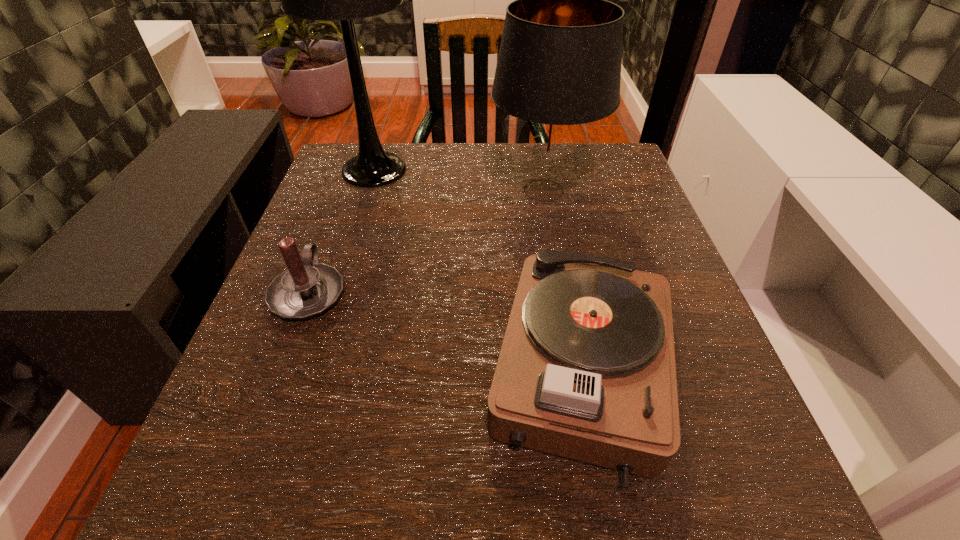
Where is `free spot between the candle and the lampshade`? free spot between the candle and the lampshade is located at coordinates (426, 241).

This screenshot has width=960, height=540. Identify the location of vacant space that's between the lampshade and the tallest object. (459, 180).

At what (x,y) coordinates should I click in order to perform the action: click on vacant area between the lampshade and the candle. Please return your answer as a coordinate pair (x, y). Looking at the image, I should click on (426, 241).

The width and height of the screenshot is (960, 540). What are the coordinates of `vacant space that's between the tallest object and the shortest object` in the screenshot? It's located at (478, 270).

The height and width of the screenshot is (540, 960). Find the location of `object that is the closest to the tallest object`. object that is the closest to the tallest object is located at coordinates (558, 72).

You are a GUI agent. You are given a task and a screenshot of the screen. Output one action in this format:
    pyautogui.click(x=<x>, y=<y>)
    Task: Click on the object that is the closest to the shortest object
    This screenshot has width=960, height=540.
    Given the screenshot: What is the action you would take?
    pyautogui.click(x=558, y=72)

Locate an element on the screen. blank space that satisfies the following two spatial constraints: 1. on the side of the candle with the handle loop; 2. on the right side of the tallest object is located at coordinates (354, 171).

Locate an element on the screen. free space in the image that satisfies the following two spatial constraints: 1. on the side of the candle with the handle loop; 2. on the right side of the table lamp is located at coordinates (354, 171).

Locate an element on the screen. The image size is (960, 540). free space that satisfies the following two spatial constraints: 1. on the side of the table lamp with the handle loop; 2. on the right side of the candle is located at coordinates (354, 171).